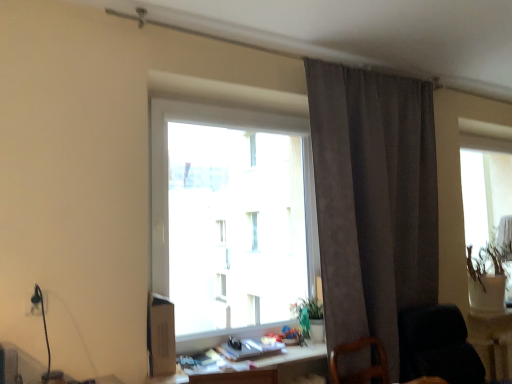
The image size is (512, 384). I want to click on free point above transparent glass window at center (from a real-world perspective), so click(x=243, y=87).